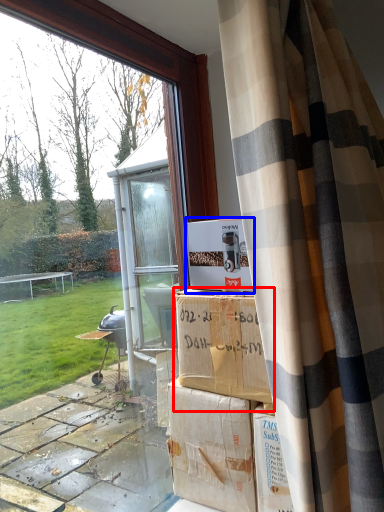
Question: Which object appears farthest to the camera in this image, cardboard box (highlighted by a red box) or cardboard box (highlighted by a blue box)?

Choices:
 (A) cardboard box
 (B) cardboard box

Answer: (B)